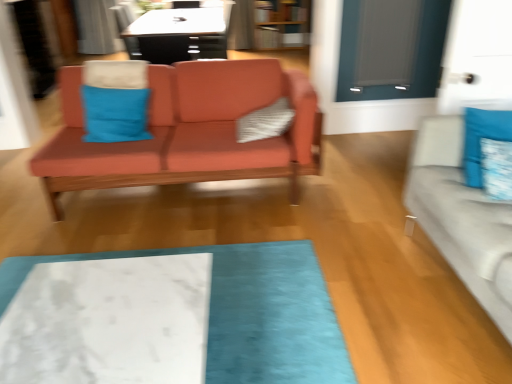
Question: Is white marble mat at lower center bigger than matte gray glass door at upper right?

Choices:
 (A) no
 (B) yes

Answer: (B)

Question: Is white marble mat at lower center thinner than matte gray glass door at upper right?

Choices:
 (A) no
 (B) yes

Answer: (A)

Question: Considering the relative positions of white marble mat at lower center and matte gray glass door at upper right in the image provided, is white marble mat at lower center in front of matte gray glass door at upper right?

Choices:
 (A) yes
 (B) no

Answer: (A)

Question: Does white marble mat at lower center have a greater width compared to matte gray glass door at upper right?

Choices:
 (A) no
 (B) yes

Answer: (B)

Question: Considering the relative sizes of white marble mat at lower center and matte gray glass door at upper right in the image provided, is white marble mat at lower center taller than matte gray glass door at upper right?

Choices:
 (A) no
 (B) yes

Answer: (A)

Question: Relative to matte gray glass door at upper right, is blue fabric pillow at center, which ranks as the 4th pillow in right-to-left order, in front or behind?

Choices:
 (A) front
 (B) behind

Answer: (A)

Question: Considering the positions of blue fabric pillow at center, which ranks as the 4th pillow in right-to-left order, and matte gray glass door at upper right in the image, is blue fabric pillow at center, which ranks as the 4th pillow in right-to-left order, wider or thinner than matte gray glass door at upper right?

Choices:
 (A) thin
 (B) wide

Answer: (B)

Question: Which is correct: blue fabric pillow at center, which ranks as the 4th pillow in right-to-left order, is inside matte gray glass door at upper right, or outside of it?

Choices:
 (A) outside
 (B) inside

Answer: (A)

Question: From their relative heights in the image, would you say blue fabric pillow at center, which is the 1th pillow in left-to-right order, is taller or shorter than matte gray glass door at upper right?

Choices:
 (A) tall
 (B) short

Answer: (B)

Question: From their relative heights in the image, would you say wooden bookshelf at upper center is taller or shorter than light gray fabric couch at right, acting as the first studio couch starting from the right?

Choices:
 (A) short
 (B) tall

Answer: (B)

Question: In the image, is wooden bookshelf at upper center positioned in front of or behind light gray fabric couch at right, which is the 2th studio couch in back-to-front order?

Choices:
 (A) front
 (B) behind

Answer: (B)

Question: In terms of size, does wooden bookshelf at upper center appear bigger or smaller than light gray fabric couch at right, which is the 1th studio couch from front to back?

Choices:
 (A) small
 (B) big

Answer: (A)

Question: Considering the positions of point (291, 0) and point (498, 288), is point (291, 0) closer or farther from the camera than point (498, 288)?

Choices:
 (A) closer
 (B) farther

Answer: (B)

Question: Is white marble mat at lower center spatially inside blue fabric pillow at right, the 3th pillow when ordered from left to right, or outside of it?

Choices:
 (A) outside
 (B) inside

Answer: (A)

Question: From a real-world perspective, is white marble mat at lower center positioned above or below blue fabric pillow at right, the 2th pillow in the right-to-left sequence?

Choices:
 (A) below
 (B) above

Answer: (A)